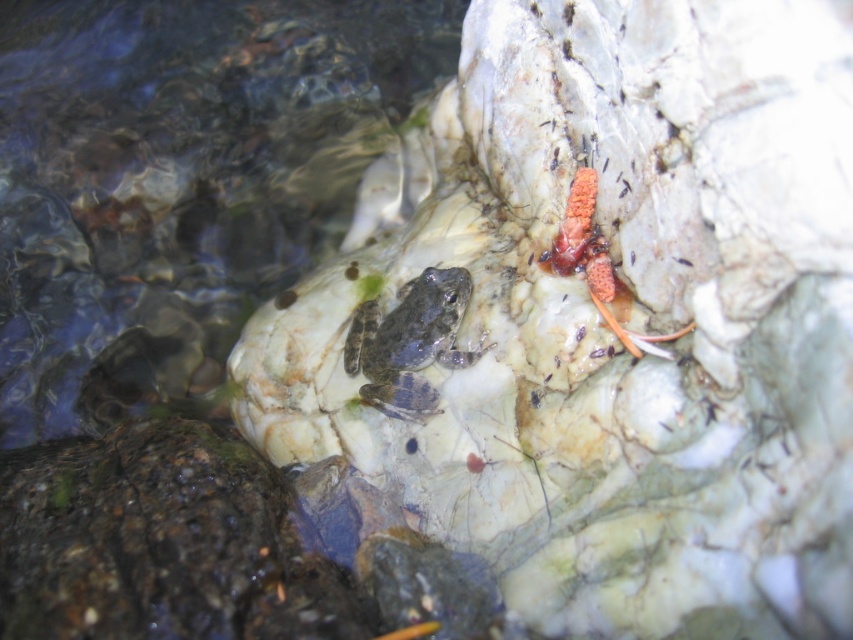
Does speckled gray frog at center have a lesser height compared to spongy orange coral at upper right?

Indeed, speckled gray frog at center has a lesser height compared to spongy orange coral at upper right.

Which is above, speckled gray frog at center or spongy orange coral at upper right?

Positioned higher is spongy orange coral at upper right.

Who is more distant from viewer, (380, 344) or (670, 337)?

The point (380, 344) is behind.

The height and width of the screenshot is (640, 853). I want to click on speckled gray frog at center, so click(x=409, y=342).

Can you confirm if clear water at center is positioned above spongy orange coral at upper right?

Yes, clear water at center is above spongy orange coral at upper right.

The image size is (853, 640). What do you see at coordinates (178, 179) in the screenshot?
I see `clear water at center` at bounding box center [178, 179].

Locate an element on the screen. This screenshot has height=640, width=853. clear water at center is located at coordinates (178, 179).

Looking at this image, can you confirm if clear water at center is taller than speckled gray frog at center?

Indeed, clear water at center has a greater height compared to speckled gray frog at center.

Between clear water at center and speckled gray frog at center, which one has less height?

Standing shorter between the two is speckled gray frog at center.

Which is in front, point (299, 234) or point (447, 272)?

Point (447, 272) is in front.

Locate an element on the screen. The height and width of the screenshot is (640, 853). clear water at center is located at coordinates (178, 179).